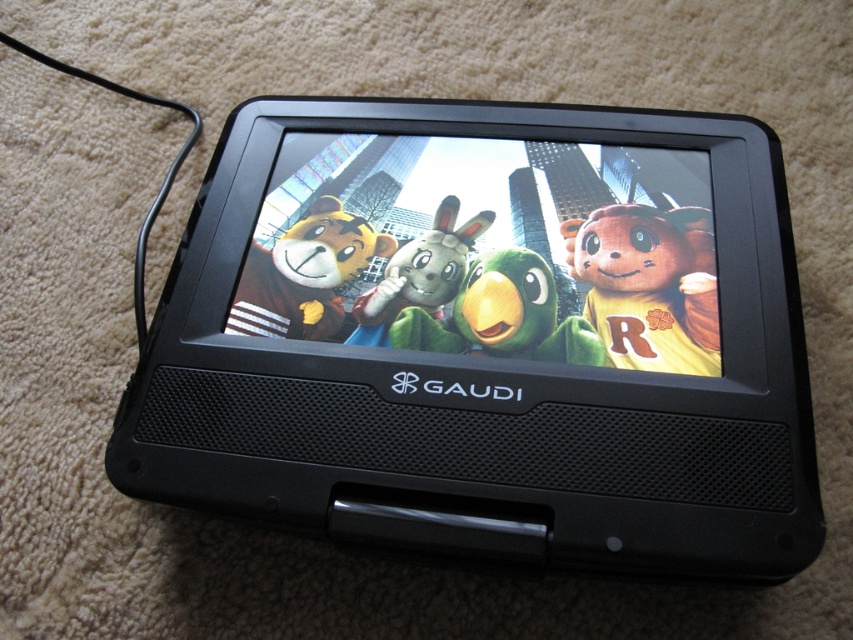
You are a character in a game that can move freely in the scene. You need to reach the point at coordinates point (473,269). However, there is an obstacle at point (410,310). Can you safely move past the obstacle to reach your destination?

Since point (473,269) is behind point (410,310), you can move around the obstacle at point (410,310) to reach your destination safely.

You are holding the Gaudi DVD player and notice a point marked on the screen. Which character is located at the point marked by the coordinates point (648, 285)?

The yellow fabric bear at center is located at the point marked by the coordinates point (648, 285).

You are a child who wants to place both the yellow fabric bear at center and the green plush rabbit at center on a small shelf. The shelf can only hold items that are no taller than 10 cm. According to the DVD player screen, can both toys fit on the shelf?

The yellow fabric bear at center is much taller than the green plush rabbit at center. Since the shelf has a height limit of 10 cm, and the bear is taller, it might exceed the limit. The rabbit might fit, but the bear may not. Check their actual heights before placing them.